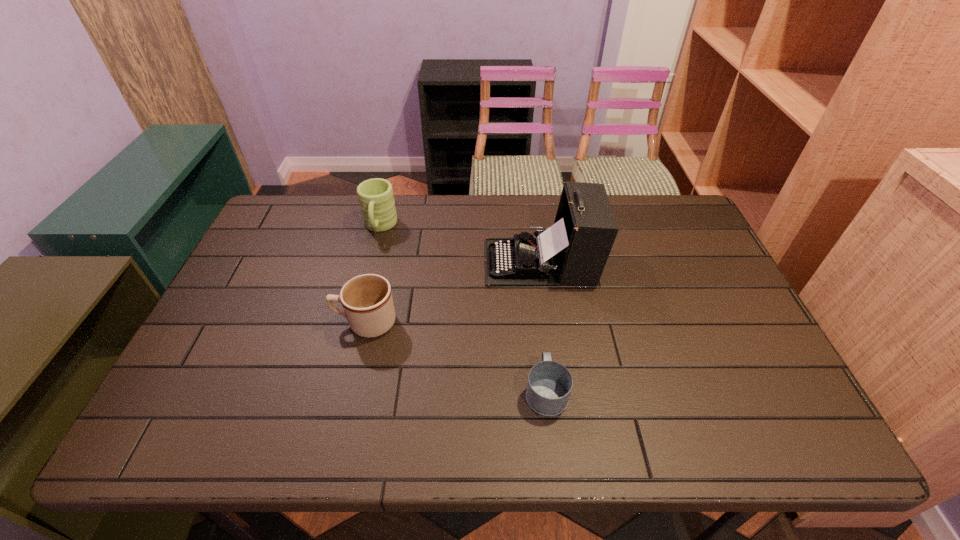
Find the location of a particular element. The width and height of the screenshot is (960, 540). vacant region located 0.280m on the side of the second farthest mug with the handle is located at coordinates (229, 322).

Find the location of `blank space located on the side of the second farthest mug with the handle`. blank space located on the side of the second farthest mug with the handle is located at coordinates coord(252,322).

Find the location of `vacant point located 0.290m on the side of the nearest mug with the handle`. vacant point located 0.290m on the side of the nearest mug with the handle is located at coordinates pos(533,281).

This screenshot has width=960, height=540. What are the coordinates of `free space located on the side of the nearest mug with the handle` in the screenshot? It's located at (530, 258).

Where is `free point located on the side of the nearest mug with the handle`? This screenshot has height=540, width=960. free point located on the side of the nearest mug with the handle is located at coordinates (536, 300).

You are a GUI agent. You are given a task and a screenshot of the screen. Output one action in this format:
    pyautogui.click(x=<x>, y=<y>)
    Task: Click on the object present at the far edge
    This screenshot has height=540, width=960.
    Given the screenshot: What is the action you would take?
    pyautogui.click(x=376, y=199)

I want to click on object that is at the near edge, so click(549, 385).

Where is `free region at the far edge of the desktop`? free region at the far edge of the desktop is located at coordinates (346, 222).

At what (x,y) coordinates should I click in order to perform the action: click on free space at the near edge of the desktop. Please return your answer as a coordinate pair (x, y). This screenshot has height=540, width=960. Looking at the image, I should click on (478, 447).

Locate an element on the screen. The height and width of the screenshot is (540, 960). vacant space at the left edge of the desktop is located at coordinates (280, 252).